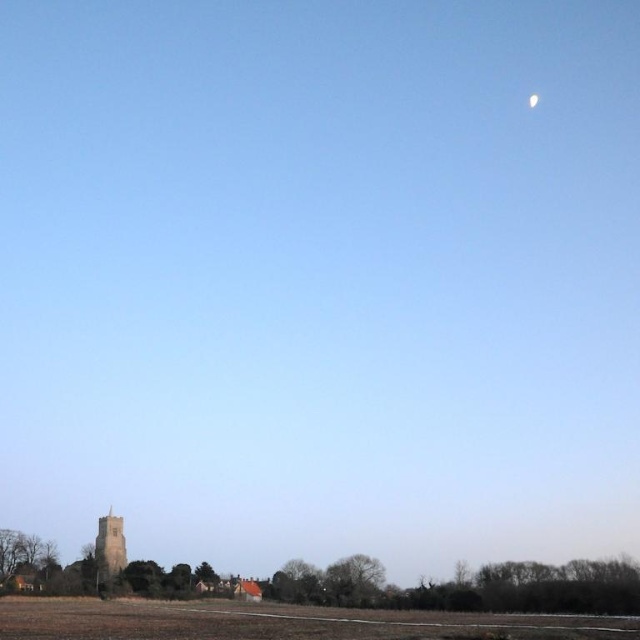
Between brown grassy field at lower center and white glossy moon at upper right, which one has less height?

white glossy moon at upper right

Identify the location of brown grassy field at lower center. (278, 621).

Find the location of a particular element. This screenshot has height=640, width=640. brown grassy field at lower center is located at coordinates (278, 621).

Which of these two, brown stone tower at lower left or white glossy moon at upper right, stands taller?

brown stone tower at lower left is taller.

Does point (109, 579) come closer to viewer compared to point (536, 93)?

Yes, it is.

Find the location of a particular element. The width and height of the screenshot is (640, 640). brown stone tower at lower left is located at coordinates (109, 547).

Does brown grassy field at lower center have a lesser height compared to brown stone tower at lower left?

Incorrect, brown grassy field at lower center's height does not fall short of brown stone tower at lower left's.

Does brown grassy field at lower center appear on the left side of brown stone tower at lower left?

In fact, brown grassy field at lower center is to the right of brown stone tower at lower left.

This screenshot has height=640, width=640. Find the location of `brown grassy field at lower center`. brown grassy field at lower center is located at coordinates (278, 621).